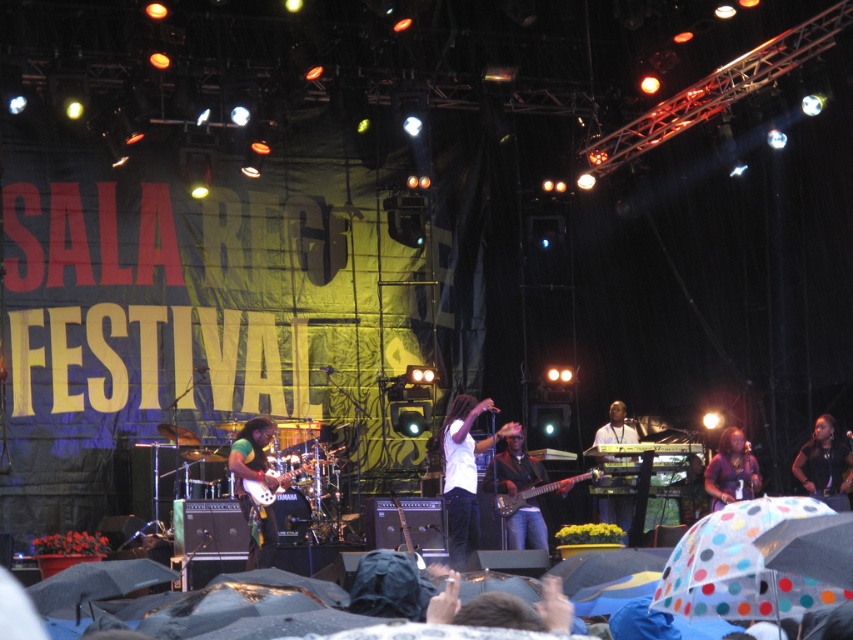
Question: Which of the following is the closest to the observer?

Choices:
 (A) shiny black guitar at center
 (B) shiny black electric guitar at center
 (C) black leather jacket at lower right
 (D) green fabric guitar at center

Answer: (D)

Question: Can you confirm if white matte shirt at center is thinner than shiny black guitar at center?

Choices:
 (A) no
 (B) yes

Answer: (A)

Question: Which is nearer to the matte purple shirt at center?

Choices:
 (A) shiny black electric guitar at center
 (B) white glossy keyboard at center

Answer: (A)

Question: Is shiny black guitar at center above shiny black electric guitar at center?

Choices:
 (A) no
 (B) yes

Answer: (A)

Question: Which object is positioned farthest from the matte purple shirt at center?

Choices:
 (A) shiny black electric guitar at center
 (B) black leather jacket at lower right

Answer: (A)

Question: Is white matte shirt at center bigger than green fabric guitar at center?

Choices:
 (A) yes
 (B) no

Answer: (A)